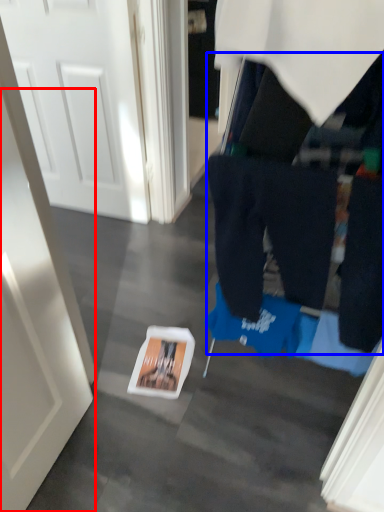
Question: Which object is closer to the camera taking this photo, door (highlighted by a red box) or tight (highlighted by a blue box)?

Choices:
 (A) door
 (B) tight

Answer: (A)